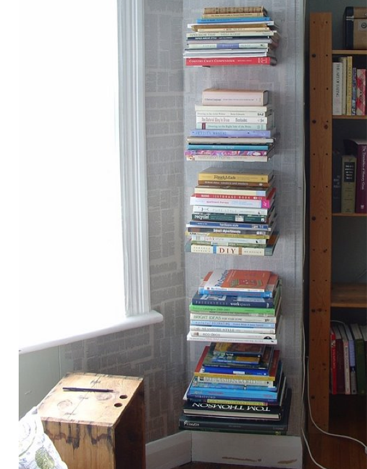
You are a GUI agent. You are given a task and a screenshot of the screen. Output one action in this format:
    pyautogui.click(x=<x>, y=<y>)
    Task: Click on the stack of books at the bottom shelf
    The image size is (367, 469).
    Given the screenshot: What is the action you would take?
    pyautogui.click(x=243, y=394)